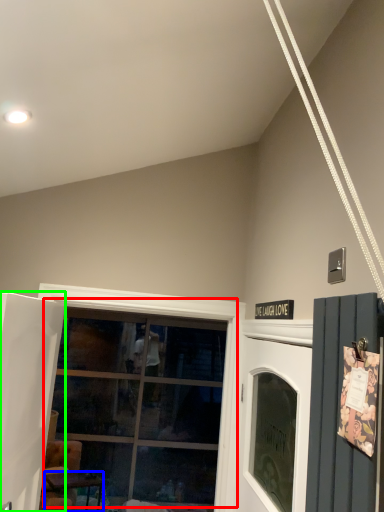
Question: Which is nearer to the window (highlighted by a red box)? table (highlighted by a blue box) or door (highlighted by a green box).

Choices:
 (A) table
 (B) door

Answer: (A)